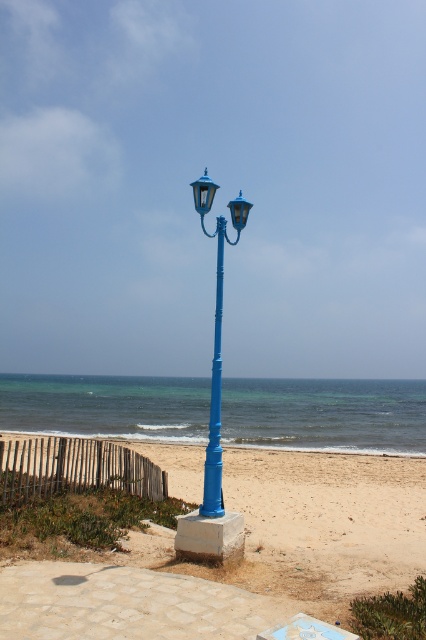
Question: Considering the relative positions of smooth sand at center and blue painted metal pole at center in the image provided, where is smooth sand at center located with respect to blue painted metal pole at center?

Choices:
 (A) below
 (B) above

Answer: (A)

Question: Estimate the real-world distances between objects in this image. Which object is farther from the blue polished metal street light at center?

Choices:
 (A) smooth sand at center
 (B) blue painted metal pole at center

Answer: (A)

Question: Is blue polished metal street light at center wider than blue painted metal pole at center?

Choices:
 (A) no
 (B) yes

Answer: (B)

Question: Does smooth sand at center appear over blue painted metal pole at center?

Choices:
 (A) yes
 (B) no

Answer: (B)

Question: Based on their relative distances, which object is farther from the blue polished metal street light at center?

Choices:
 (A) blue painted metal pole at center
 (B) smooth sand at center

Answer: (B)

Question: Which point is farther to the camera?

Choices:
 (A) smooth sand at center
 (B) blue painted metal pole at center

Answer: (B)